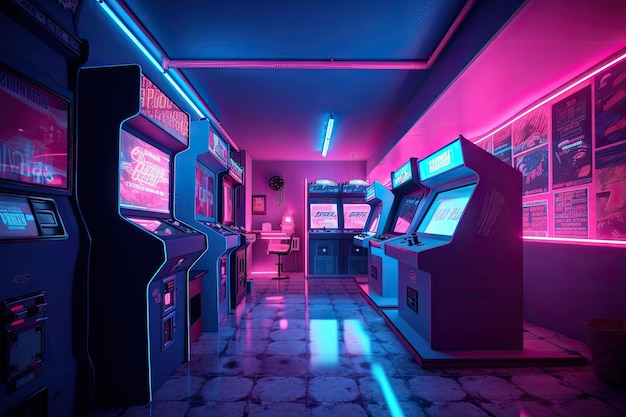
You are a GUI agent. You are given a task and a screenshot of the screen. Output one action in this format:
    pyautogui.click(x=<x>, y=<y>)
    Task: Click on the light reflection on floor
    Image resolution: width=626 pixels, height=417 pixels.
    Given the screenshot: What is the action you would take?
    click(x=324, y=342), click(x=350, y=336), click(x=385, y=384), click(x=282, y=318), click(x=279, y=296), click(x=275, y=301), click(x=245, y=323)